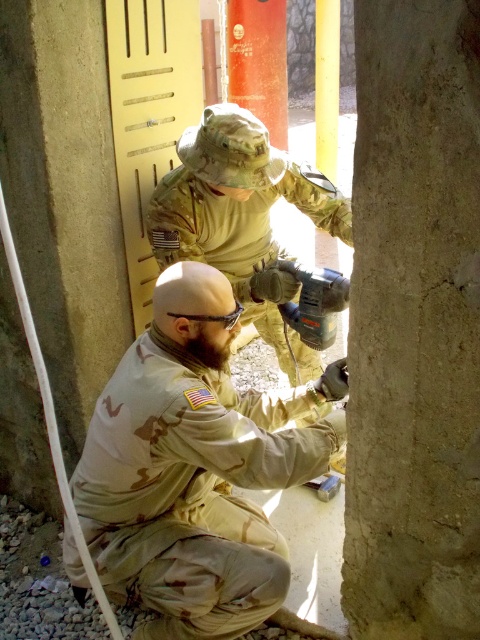
Which is more to the left, tan camouflage uniform at center or camouflage uniform at center?

tan camouflage uniform at center is more to the left.

Where is `tan camouflage uniform at center`? The image size is (480, 640). tan camouflage uniform at center is located at coordinates (194, 468).

Is camouflage uniform at center below metallic gray drill at center?

No.

Is the position of camouflage uniform at center more distant than that of metallic gray drill at center?

Yes.

This screenshot has width=480, height=640. What do you see at coordinates (241, 218) in the screenshot? I see `camouflage uniform at center` at bounding box center [241, 218].

Where is `camouflage uniform at center`? camouflage uniform at center is located at coordinates [x=241, y=218].

Does tan camouflage uniform at center have a lesser height compared to metallic gray drill at center?

Answer: No.

You are a GUI agent. You are given a task and a screenshot of the screen. Output one action in this format:
    pyautogui.click(x=<x>, y=<y>)
    Task: Click on the tan camouflage uniform at center
    Image resolution: width=480 pixels, height=640 pixels.
    Given the screenshot: What is the action you would take?
    pyautogui.click(x=194, y=468)

Where is `tan camouflage uniform at center`? tan camouflage uniform at center is located at coordinates click(x=194, y=468).